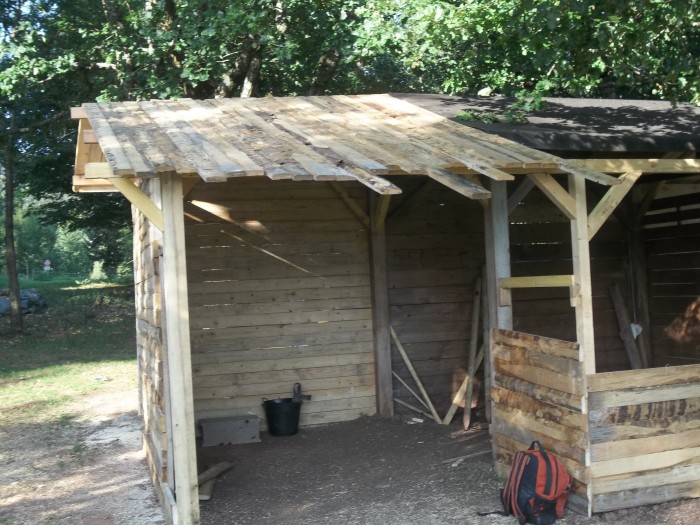
This screenshot has width=700, height=525. Find the location of `small grey wooden step or box`. small grey wooden step or box is located at coordinates (209, 425), (246, 428).